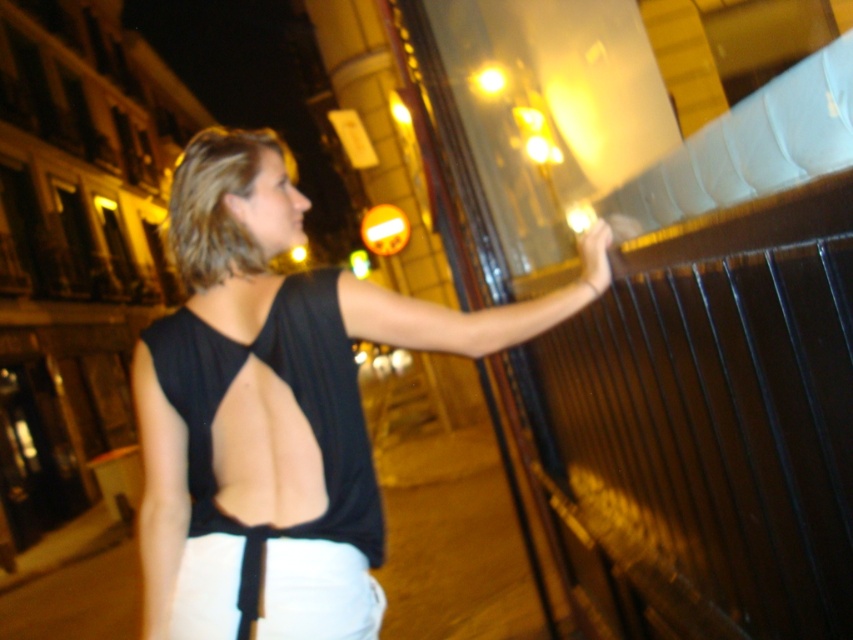
Is black matte bikini top at upper center further to the viewer compared to matte black hand at upper right?

That is False.

Which is behind, point (316, 276) or point (593, 250)?

Point (593, 250)

Identify the location of black matte bikini top at upper center. The image size is (853, 640). (294, 401).

Is dark wood fence at upper right smaller than black matte tank top at center?

Correct, dark wood fence at upper right occupies less space than black matte tank top at center.

Does dark wood fence at upper right lie behind black matte tank top at center?

No.

At what (x,y) coordinates should I click in order to perform the action: click on dark wood fence at upper right. Please return your answer as a coordinate pair (x, y). This screenshot has width=853, height=640. Looking at the image, I should click on (706, 426).

Locate an element on the screen. The image size is (853, 640). dark wood fence at upper right is located at coordinates (706, 426).

Is point (776, 326) positioned before point (606, 234)?

Yes, point (776, 326) is in front of point (606, 234).

Does point (532, 394) come farther from viewer compared to point (598, 227)?

That is True.

Where is `dark wood fence at upper right`? Image resolution: width=853 pixels, height=640 pixels. dark wood fence at upper right is located at coordinates (706, 426).